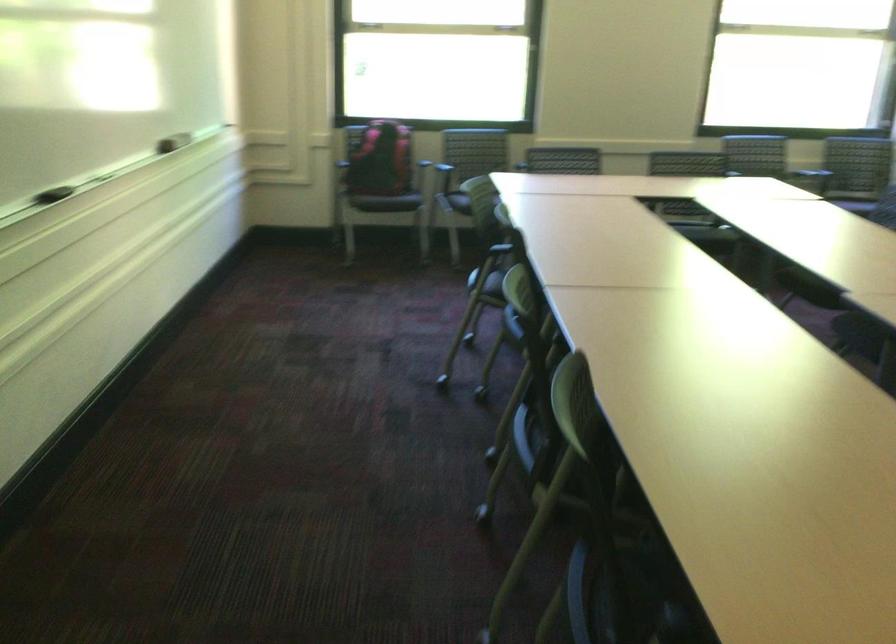
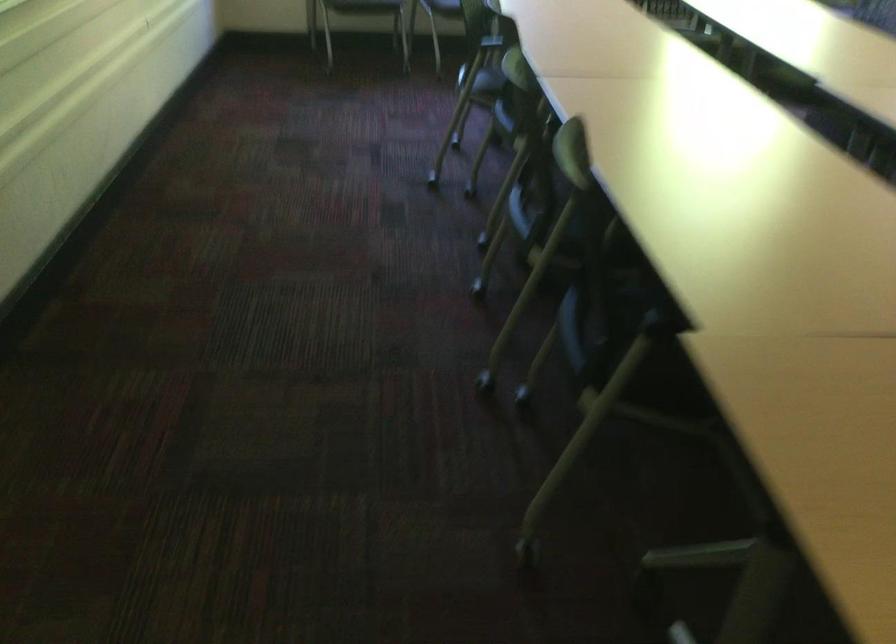
Question: The images are taken continuously from a first-person perspective. In which direction is your viewpoint rotating?

Choices:
 (A) Left
 (B) Right
 (C) Up
 (D) Down

Answer: (D)